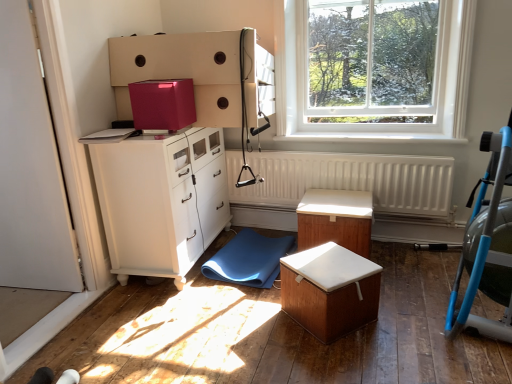
The image size is (512, 384). What are the coordinates of `vacant area that lies between wooden box with white cushion at center, marked as the second table in a back-to-front arrangement, and blue plastic baby carriage at right` in the screenshot? It's located at (406, 323).